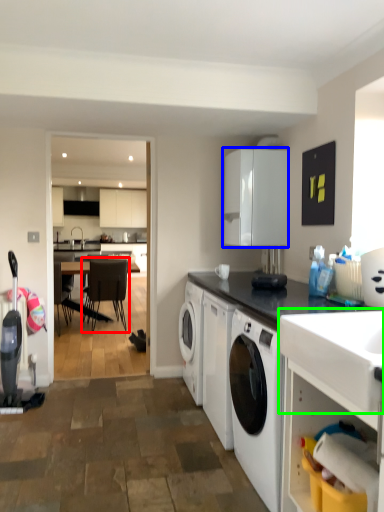
Question: Which is farther away from chair (highlighted by a red box)? cabinetry (highlighted by a blue box) or sink (highlighted by a green box)?

Choices:
 (A) cabinetry
 (B) sink

Answer: (B)